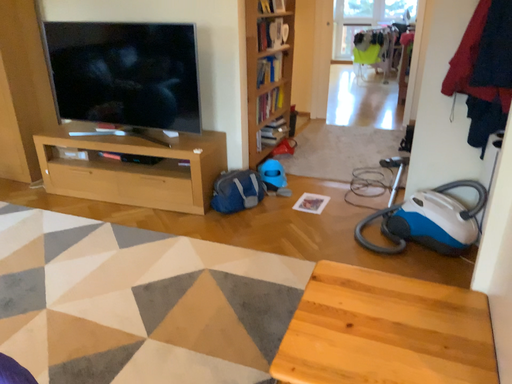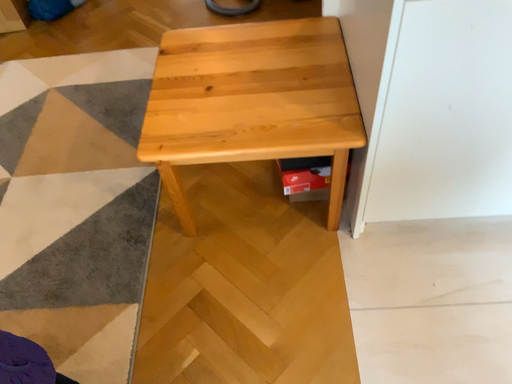
Question: How did the camera likely rotate when shooting the video?

Choices:
 (A) rotated upward
 (B) rotated downward

Answer: (B)